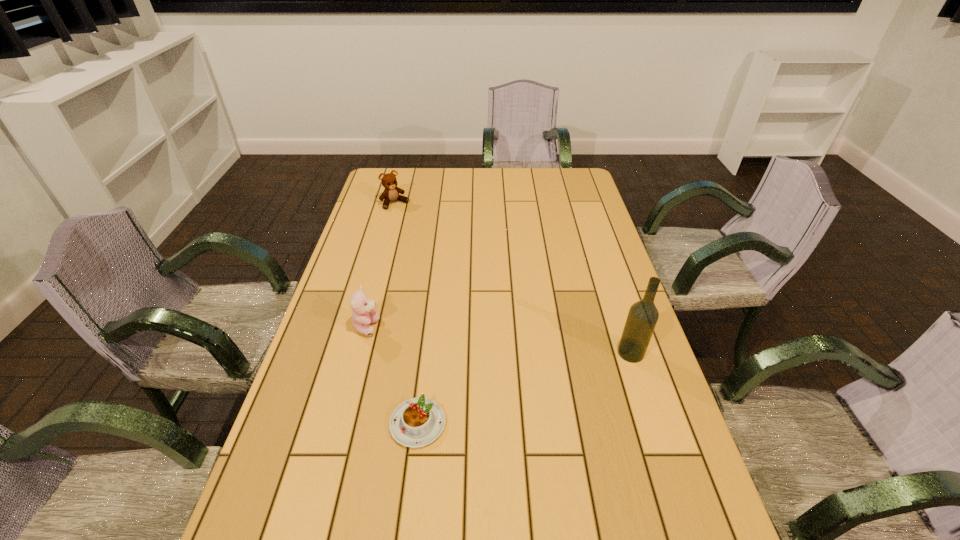
You are a GUI agent. You are given a task and a screenshot of the screen. Output one action in this format:
    pyautogui.click(x=<x>, y=<y>)
    Task: Click on the nearest object
    This screenshot has height=540, width=960.
    Given the screenshot: What is the action you would take?
    pyautogui.click(x=417, y=422)

The height and width of the screenshot is (540, 960). Find the location of `the second object from right to left`. the second object from right to left is located at coordinates tap(417, 422).

The height and width of the screenshot is (540, 960). Identify the location of vodka. (643, 315).

Locate an element on the screen. The width and height of the screenshot is (960, 540). the rightmost object is located at coordinates (643, 315).

The height and width of the screenshot is (540, 960). I want to click on the farthest object, so click(391, 192).

Where is `the third nearest object`? the third nearest object is located at coordinates (364, 313).

This screenshot has height=540, width=960. I want to click on vacant area situated 0.240m on the back of the shortest object, so click(429, 325).

Locate an element on the screen. The image size is (960, 540). free spot located 0.050m on the left of the third farthest object is located at coordinates (599, 353).

The height and width of the screenshot is (540, 960). I want to click on vacant area situated on the front-facing side of the farthest object, so click(x=449, y=262).

Locate an element on the screen. free spot located 0.160m on the front-facing side of the farthest object is located at coordinates (420, 230).